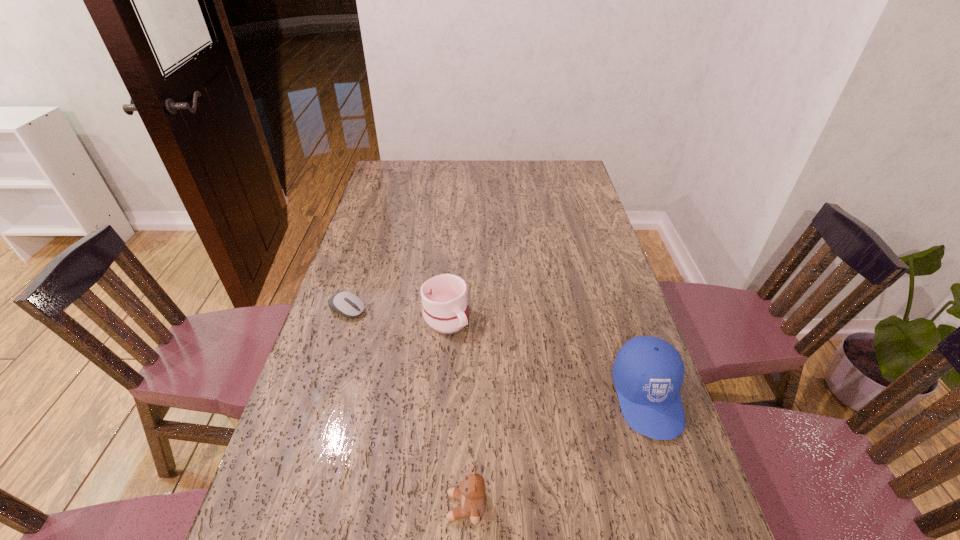
You are a GUI agent. You are given a task and a screenshot of the screen. Output one action in this format:
    pyautogui.click(x=<x>, y=<y>)
    Task: Click on the free spot on the desktop that is between the nearest object and the rightmost object and is positioned on the side with the handle of the mug
    The height and width of the screenshot is (540, 960).
    Given the screenshot: What is the action you would take?
    pyautogui.click(x=545, y=458)

Image resolution: width=960 pixels, height=540 pixels. I want to click on vacant space on the desktop that is between the nearest object and the second nearest object and is positioned on the wheel side of the leftmost object, so click(591, 431).